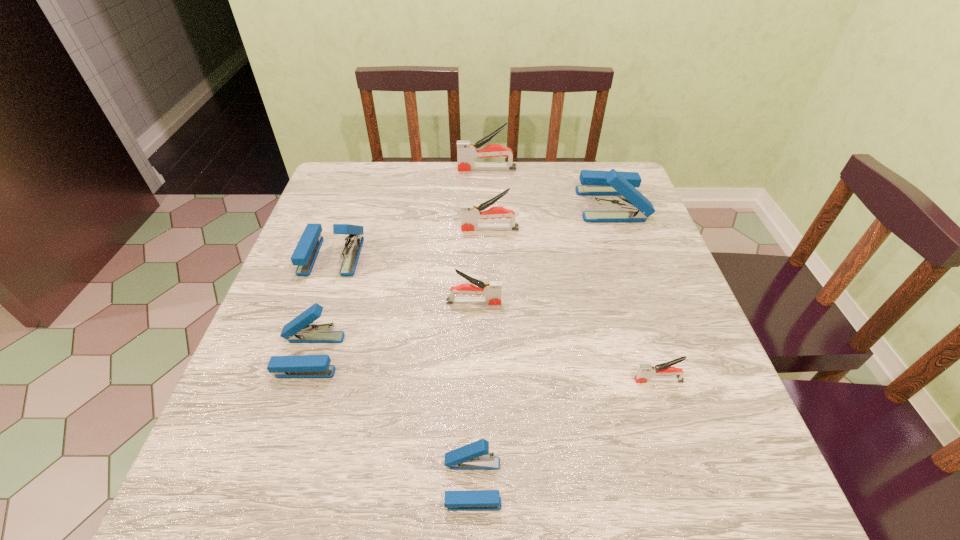
I want to click on vacant space that's between the smallest blue stapler and the third biggest gray stapler, so click(x=473, y=393).

At what (x,y) coordinates should I click in order to perform the action: click on free space between the nearest stapler and the third farthest object. Please return your answer as a coordinate pair (x, y). Image resolution: width=960 pixels, height=540 pixels. Looking at the image, I should click on (481, 356).

I want to click on unoccupied area between the nearest gray stapler and the second nearest blue stapler, so click(x=484, y=368).

Locate an element on the screen. vacant point located between the fourth nearest object and the rightmost gray stapler is located at coordinates (566, 341).

Locate an element on the screen. free space between the third biggest blue stapler and the smallest gray stapler is located at coordinates (484, 368).

The image size is (960, 540). Identify the location of unoccupied area between the farthest object and the second farthest gray stapler. (489, 199).

This screenshot has height=540, width=960. I want to click on vacant space that is in between the seventh nearest stapler and the farthest stapler, so click(549, 187).

Find the location of a particular element. The image size is (960, 540). free space between the sixth nearest stapler and the fifth farthest stapler is located at coordinates (482, 266).

Select which object is the fourth closest to the seventh nearest stapler. Please provide its 2D coordinates. Your answer should be formatted as a tuple, i.e. [(x, y)], where the tuple contains the x and y coordinates of a point satisfying the conditions above.

[(646, 373)]

Locate which object ranks in proximity to the third smallest gray stapler. Please provide its 2D coordinates. Your answer should be formatted as a tuple, i.e. [(x, y)], where the tuple contains the x and y coordinates of a point satisfying the conditions above.

[(594, 183)]